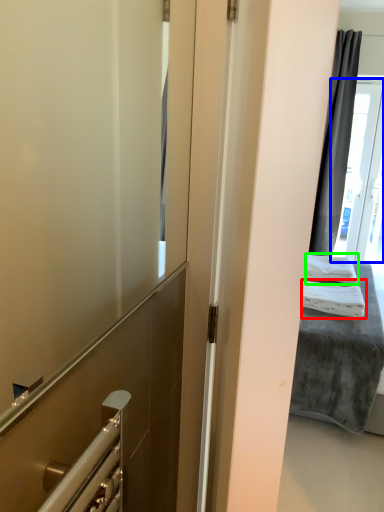
Question: Considering the real-world distances, which object is farthest from bath towel (highlighted by a red box)? glass door (highlighted by a blue box) or bath towel (highlighted by a green box)?

Choices:
 (A) glass door
 (B) bath towel

Answer: (A)